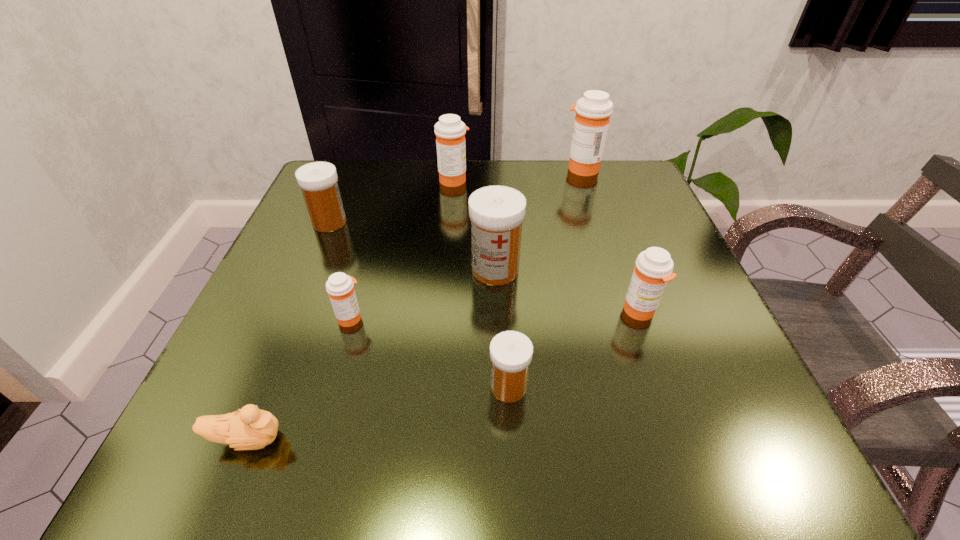
I want to click on the tallest medicine, so click(x=593, y=111).

Where is `the biggest orange medicine`? the biggest orange medicine is located at coordinates (593, 111).

Find the location of a particular element. Image resolution: width=960 pixels, height=540 pixels. the third medicine from left to right is located at coordinates (450, 131).

Identify the location of the fifth object from right to left. The height and width of the screenshot is (540, 960). (450, 131).

At what (x,y) coordinates should I click in order to perform the action: click on the second farthest white medicine. Please return your answer as a coordinate pair (x, y). Looking at the image, I should click on (497, 212).

Where is `the fourth farthest object`? This screenshot has width=960, height=540. the fourth farthest object is located at coordinates (497, 212).

Locate an element on the screen. the leftmost white medicine is located at coordinates (318, 180).

This screenshot has height=540, width=960. I want to click on the third farthest medicine, so click(x=318, y=180).

You are a GUI agent. You are given a task and a screenshot of the screen. Output one action in this format:
    pyautogui.click(x=<x>, y=<y>)
    Task: Click on the third biggest orange medicine
    The height and width of the screenshot is (540, 960).
    Given the screenshot: What is the action you would take?
    pyautogui.click(x=653, y=269)

You are a GUI agent. You are given a task and a screenshot of the screen. Output one action in this format:
    pyautogui.click(x=<x>, y=<y>)
    Task: Click on the leftmost orange medicine
    The image size is (960, 540).
    Given the screenshot: What is the action you would take?
    pyautogui.click(x=340, y=287)